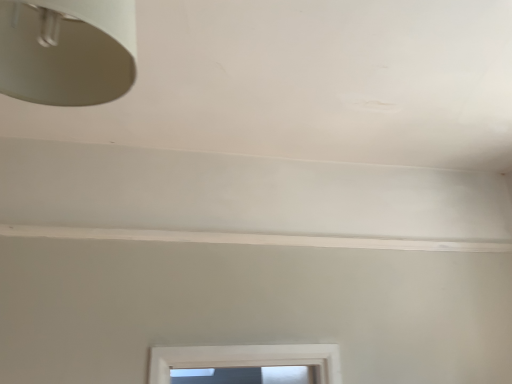
Locate an element on the screen. The width and height of the screenshot is (512, 384). white matte lampshade at upper left is located at coordinates (67, 50).

This screenshot has height=384, width=512. What do you see at coordinates (67, 50) in the screenshot?
I see `white matte lampshade at upper left` at bounding box center [67, 50].

Where is `white matte lampshade at upper left`? white matte lampshade at upper left is located at coordinates (67, 50).